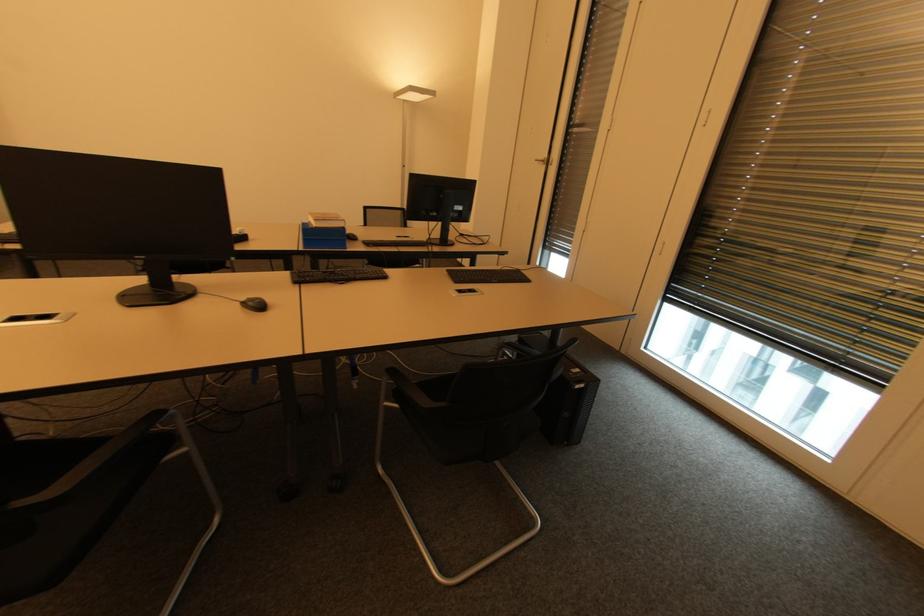
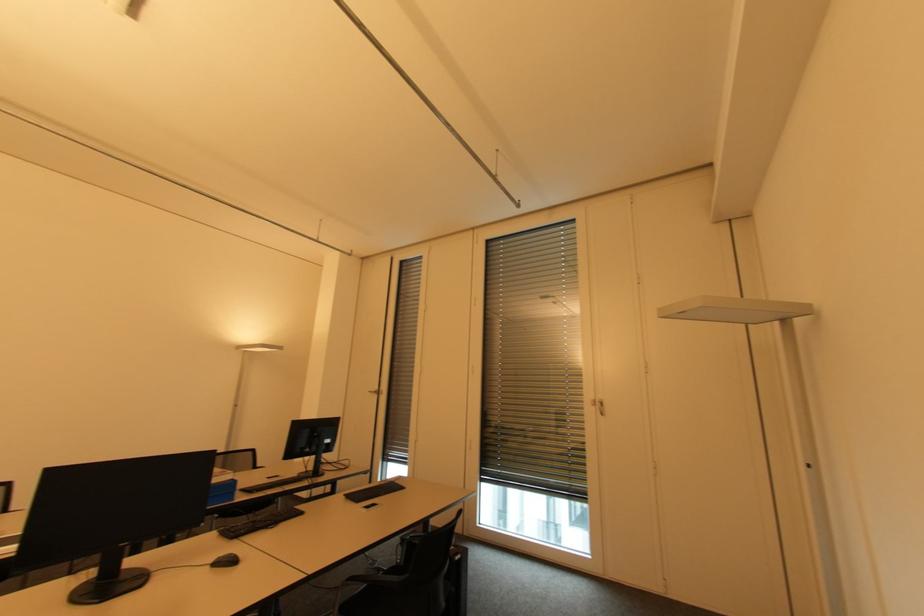
Where in the second image is the point corresponding to point (239, 305) from the first image?

(210, 567)